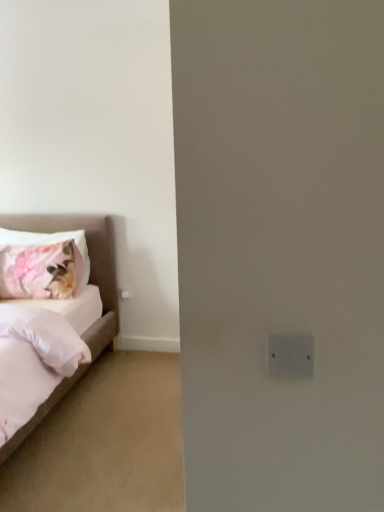
Question: From the image's perspective, is white fabric bed at left positioned above or below floral fabric pillow at left?

Choices:
 (A) above
 (B) below

Answer: (B)

Question: Do you think white fabric bed at left is within floral fabric pillow at left, or outside of it?

Choices:
 (A) outside
 (B) inside

Answer: (A)

Question: Considering the positions of white fabric bed at left and floral fabric pillow at left in the image, is white fabric bed at left wider or thinner than floral fabric pillow at left?

Choices:
 (A) thin
 (B) wide

Answer: (B)

Question: Is point (79, 274) positioned closer to the camera than point (96, 244)?

Choices:
 (A) farther
 (B) closer

Answer: (B)

Question: From the image's perspective, is floral fabric pillow at left above or below white fabric bed at left?

Choices:
 (A) below
 (B) above

Answer: (B)

Question: Considering the positions of floral fabric pillow at left and white fabric bed at left in the image, is floral fabric pillow at left wider or thinner than white fabric bed at left?

Choices:
 (A) wide
 (B) thin

Answer: (B)

Question: From a real-world perspective, is floral fabric pillow at left above or below white fabric bed at left?

Choices:
 (A) below
 (B) above

Answer: (B)